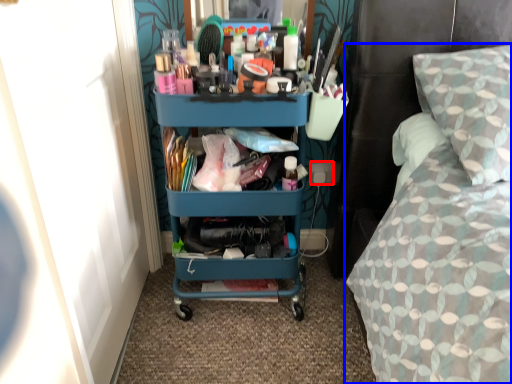
Question: Which point is further to the camera, power outlet (highlighted by a red box) or bed (highlighted by a blue box)?

Choices:
 (A) power outlet
 (B) bed

Answer: (A)